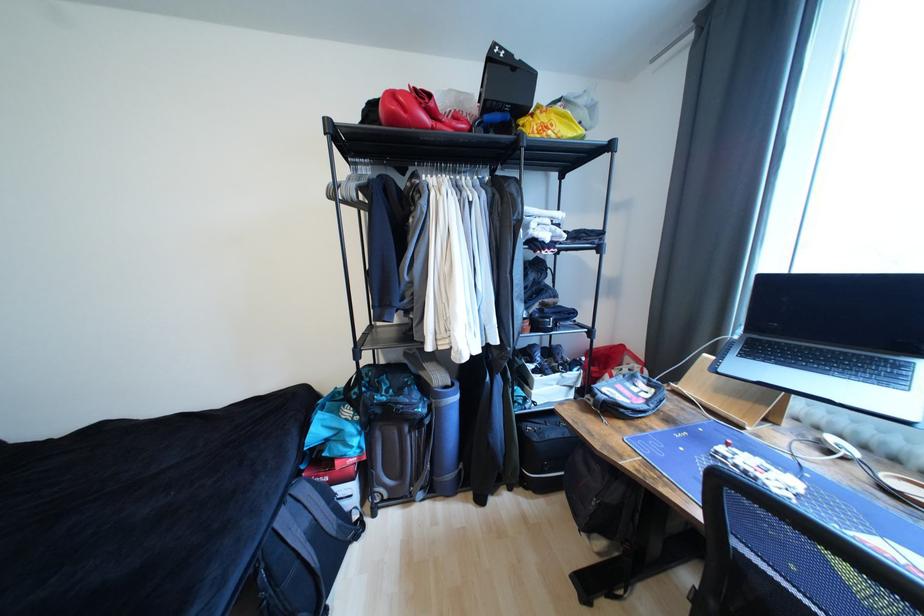
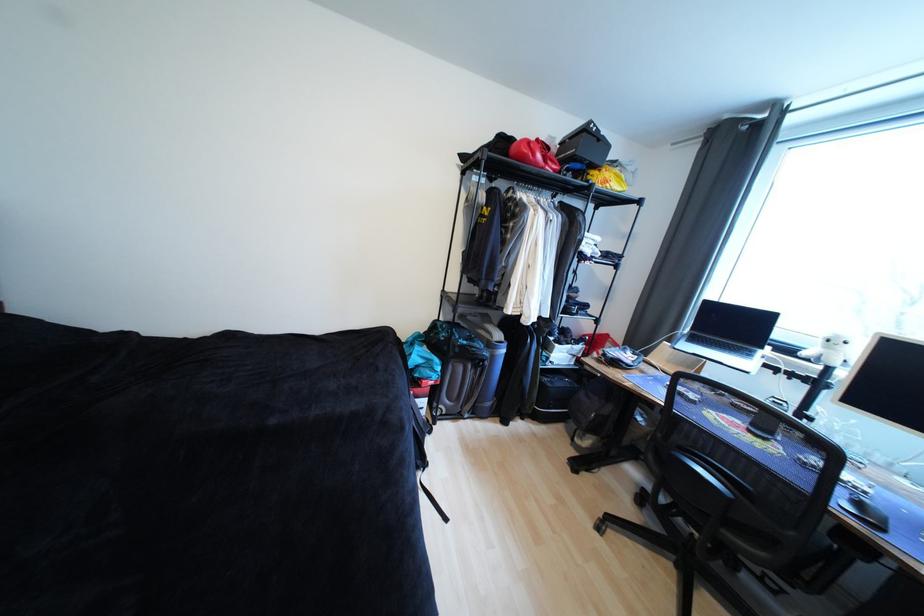
The point at [400,121] is marked in the first image. Where is the corresponding point in the second image?

(529, 159)